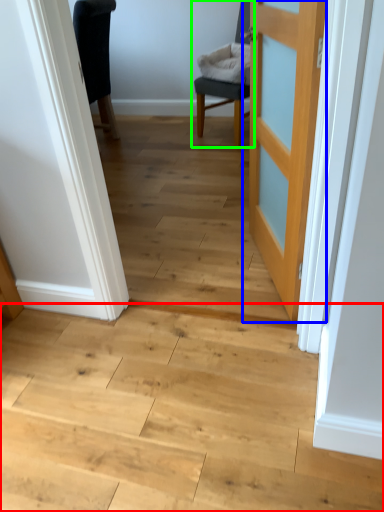
Question: Which is farther away from stairwell (highlighted by a red box)? door (highlighted by a blue box) or chair (highlighted by a green box)?

Choices:
 (A) door
 (B) chair

Answer: (B)